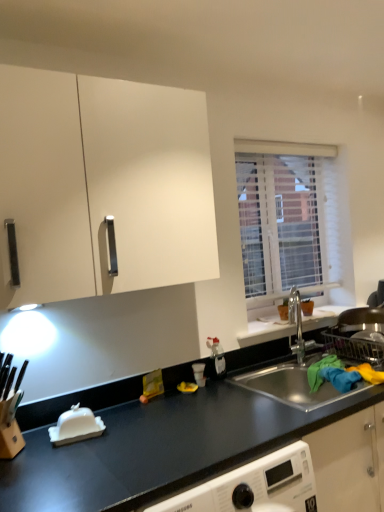
Question: Considering the relative sizes of white textured blinds at upper right and white matte cabinet at upper left in the image provided, is white textured blinds at upper right wider than white matte cabinet at upper left?

Choices:
 (A) no
 (B) yes

Answer: (A)

Question: Is white textured blinds at upper right at the right side of white matte cabinet at upper left?

Choices:
 (A) no
 (B) yes

Answer: (B)

Question: Is white textured blinds at upper right far from white matte cabinet at upper left?

Choices:
 (A) yes
 (B) no

Answer: (B)

Question: Are white textured blinds at upper right and white matte cabinet at upper left beside each other?

Choices:
 (A) yes
 (B) no

Answer: (B)

Question: From the image's perspective, is white textured blinds at upper right located above white matte cabinet at upper left?

Choices:
 (A) yes
 (B) no

Answer: (B)

Question: Is white matte cabinet at upper left in front of or behind black matte countertop at center in the image?

Choices:
 (A) behind
 (B) front

Answer: (A)

Question: Do you think white matte cabinet at upper left is within black matte countertop at center, or outside of it?

Choices:
 (A) inside
 (B) outside

Answer: (B)

Question: Does point (193, 211) appear closer or farther from the camera than point (41, 502)?

Choices:
 (A) closer
 (B) farther

Answer: (B)

Question: From the image's perspective, is white matte cabinet at upper left above or below black matte countertop at center?

Choices:
 (A) below
 (B) above

Answer: (B)

Question: Visually, is black matte countertop at center positioned to the left or to the right of white matte cabinet at upper left?

Choices:
 (A) left
 (B) right

Answer: (B)

Question: Considering the positions of point (172, 394) and point (187, 177), is point (172, 394) closer or farther from the camera than point (187, 177)?

Choices:
 (A) farther
 (B) closer

Answer: (A)

Question: From a real-world perspective, is black matte countertop at center above or below white matte cabinet at upper left?

Choices:
 (A) below
 (B) above

Answer: (A)

Question: In terms of width, does black matte countertop at center look wider or thinner when compared to white matte cabinet at upper left?

Choices:
 (A) thin
 (B) wide

Answer: (B)

Question: In terms of height, does white matte cabinet at upper left look taller or shorter compared to stainless steel sink at lower right?

Choices:
 (A) tall
 (B) short

Answer: (A)

Question: From a real-world perspective, is white matte cabinet at upper left physically located above or below stainless steel sink at lower right?

Choices:
 (A) below
 (B) above

Answer: (B)